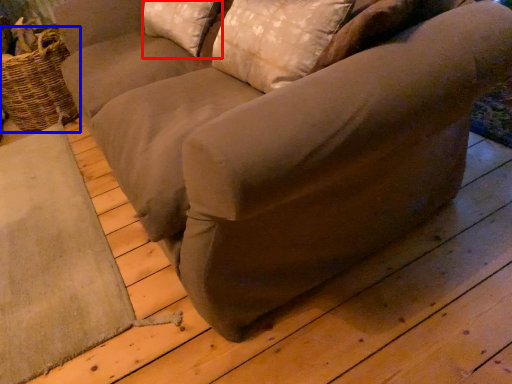
Question: Which of the following is the farthest to the observer, pillow (highlighted by a red box) or basket (highlighted by a blue box)?

Choices:
 (A) pillow
 (B) basket

Answer: (B)